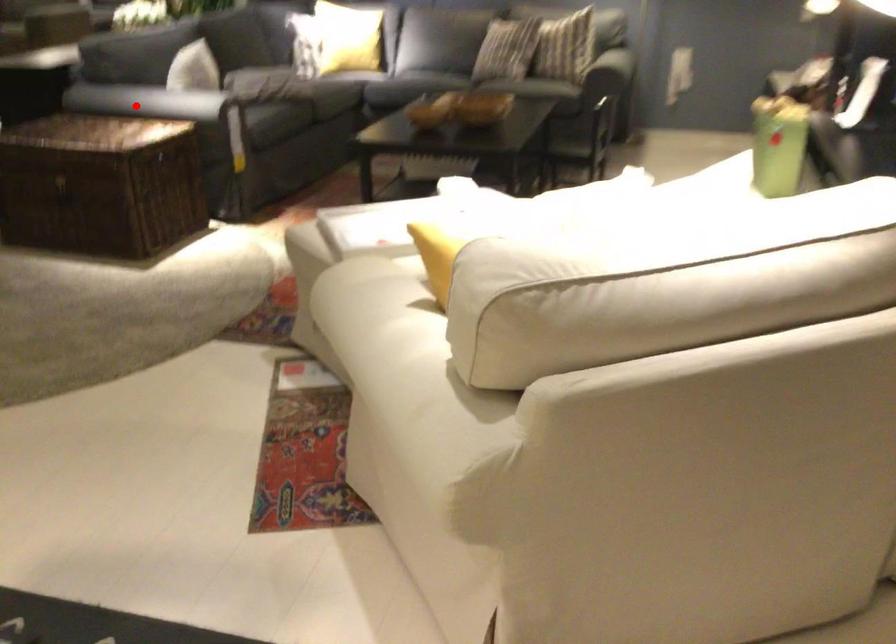
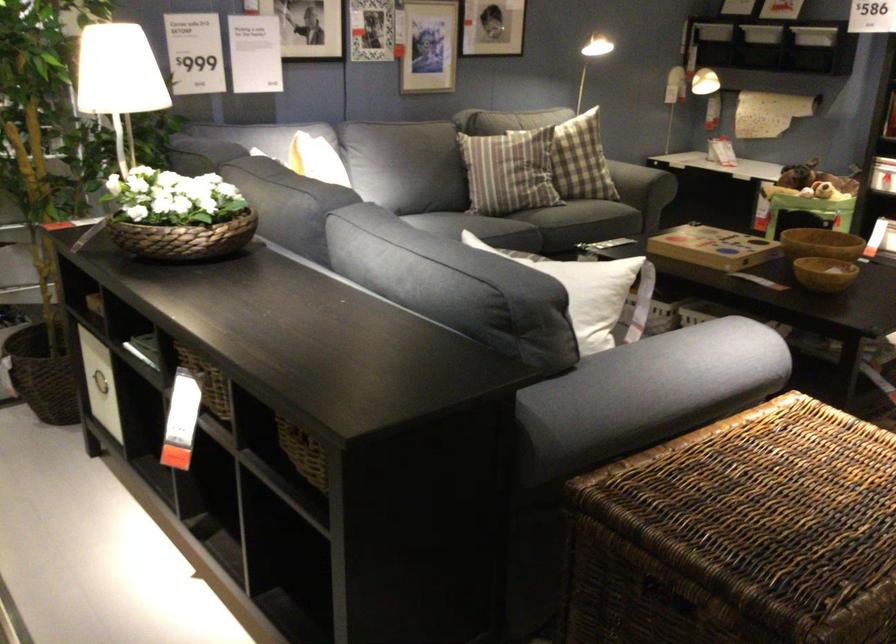
Question: I am providing you with two images of the same scene from different viewpoints. Given a red point in image1, look at the same physical point in image2. Is it:

Choices:
 (A) Closer to the viewpoint
 (B) Farther from the viewpoint

Answer: (A)